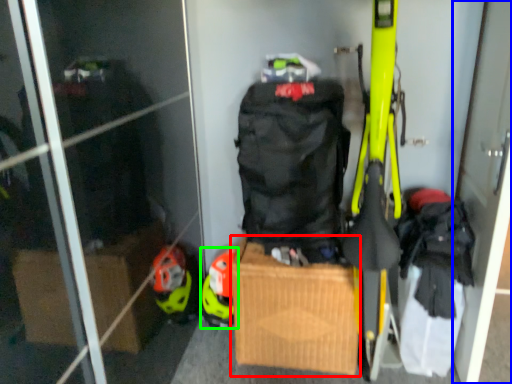
Question: Which is nearer to the cardboard box (highlighted by a red box)? screen door (highlighted by a blue box) or helmet (highlighted by a green box).

Choices:
 (A) screen door
 (B) helmet

Answer: (B)